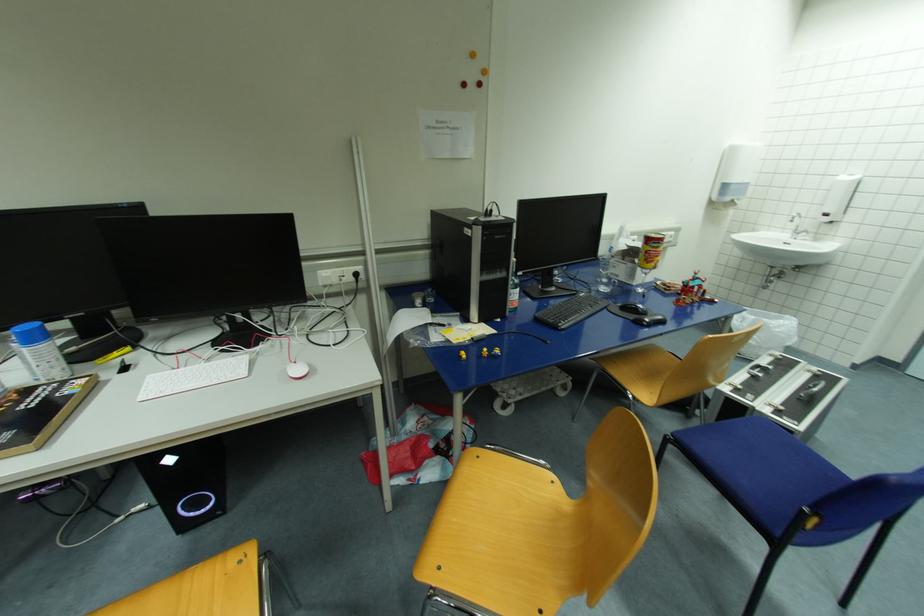
Describe the element at coordinates (195, 504) in the screenshot. Image resolution: width=924 pixels, height=616 pixels. I see `the PC disc drive button` at that location.